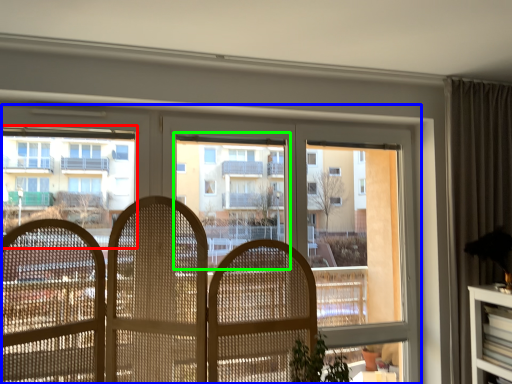
Question: Which object is the closest to the condominium (highlighted by a red box)? Choose among these: window (highlighted by a blue box) or bay window (highlighted by a green box).

Choices:
 (A) window
 (B) bay window

Answer: (A)